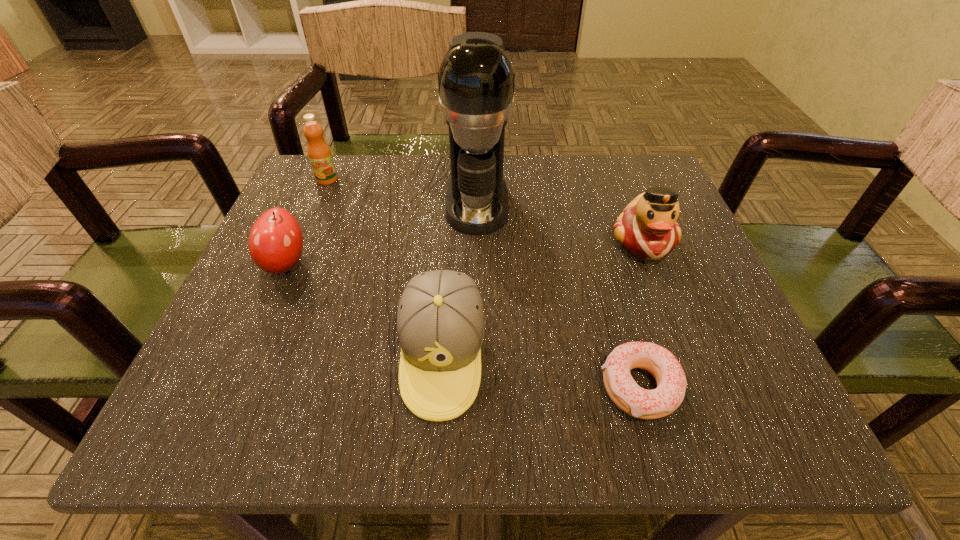
At what (x,y) coordinates should I click in order to perform the action: click on vacant space located on the back of the doughnut. Please return your answer as a coordinate pair (x, y). The image size is (960, 540). Looking at the image, I should click on (602, 253).

Find the location of a particular element. coffee maker located at the far edge is located at coordinates (476, 78).

Where is `orange juice that is at the far edge`? orange juice that is at the far edge is located at coordinates (319, 153).

What are the coordinates of `duck present at the far edge` in the screenshot? It's located at (647, 229).

You are a GUI agent. You are given a task and a screenshot of the screen. Output one action in this format:
    pyautogui.click(x=<x>, y=<y>)
    Task: Click on the baseball cap present at the near edge
    
    Given the screenshot: What is the action you would take?
    pyautogui.click(x=440, y=321)

Identify the location of doughnut that is at the near edge. (671, 381).

This screenshot has width=960, height=540. I want to click on orange juice that is at the left edge, so click(319, 153).

Where is `apple at the left edge`? apple at the left edge is located at coordinates (275, 243).

Locate an element on the screen. The height and width of the screenshot is (540, 960). duck located at the right edge is located at coordinates (647, 229).

Find the location of a particular element. This screenshot has width=960, height=540. doughnut located at the right edge is located at coordinates (671, 381).